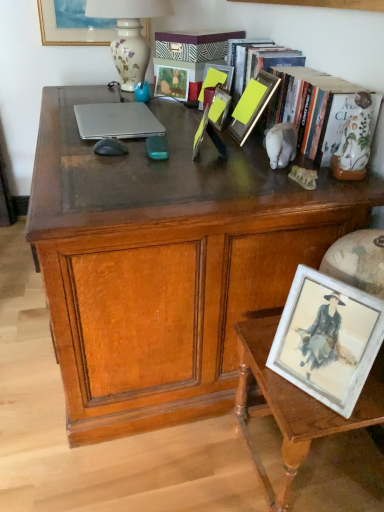
Question: Is wooden table at lower right bigger than matte gold picture frame at upper left, which is the seventh picture frame from front to back?

Choices:
 (A) no
 (B) yes

Answer: (B)

Question: Is matte gold picture frame at upper left, which is the seventh picture frame from front to back, a part of wooden table at lower right?

Choices:
 (A) yes
 (B) no

Answer: (B)

Question: From the image's perspective, is wooden table at lower right located beneath matte gold picture frame at upper left, which is the seventh picture frame from front to back?

Choices:
 (A) no
 (B) yes

Answer: (B)

Question: Is wooden table at lower right with matte gold picture frame at upper left, which is the seventh picture frame from front to back?

Choices:
 (A) yes
 (B) no

Answer: (B)

Question: From the image's perspective, is wooden table at lower right on top of matte gold picture frame at upper left, which appears as the 1th picture frame when viewed from the top?

Choices:
 (A) no
 (B) yes

Answer: (A)

Question: In terms of height, does wooden table at lower right look taller or shorter compared to matte glass picture frame at center, the 4th picture frame in the bottom-to-top sequence?

Choices:
 (A) tall
 (B) short

Answer: (A)

Question: From the image's perspective, is wooden table at lower right positioned above or below matte glass picture frame at center, the 4th picture frame in the bottom-to-top sequence?

Choices:
 (A) below
 (B) above

Answer: (A)

Question: From a real-world perspective, is wooden table at lower right above or below matte glass picture frame at center, which is the fourth picture frame from front to back?

Choices:
 (A) below
 (B) above

Answer: (A)

Question: Is wooden table at lower right in front of or behind matte glass picture frame at center, the 4th picture frame in the bottom-to-top sequence, in the image?

Choices:
 (A) behind
 (B) front

Answer: (B)

Question: In terms of width, does yellow matte picture frame at center, the second picture frame in the front-to-back sequence, look wider or thinner when compared to matte gold picture frame at upper left, arranged as the 7th picture frame when ordered from the bottom?

Choices:
 (A) wide
 (B) thin

Answer: (A)

Question: Which is correct: yellow matte picture frame at center, placed as the 2th picture frame when sorted from bottom to top, is inside matte gold picture frame at upper left, arranged as the 7th picture frame when ordered from the bottom, or outside of it?

Choices:
 (A) outside
 (B) inside

Answer: (A)

Question: In terms of height, does yellow matte picture frame at center, placed as the 2th picture frame when sorted from bottom to top, look taller or shorter compared to matte gold picture frame at upper left, which is the seventh picture frame from front to back?

Choices:
 (A) tall
 (B) short

Answer: (A)

Question: Relative to matte gold picture frame at upper left, which is the seventh picture frame from front to back, is yellow matte picture frame at center, which ranks as the 6th picture frame in top-to-bottom order, in front or behind?

Choices:
 (A) front
 (B) behind

Answer: (A)

Question: Visually, is hardcover book at upper right positioned to the left or to the right of matte wooden picture frame at center, arranged as the 3th picture frame when viewed from the top?

Choices:
 (A) left
 (B) right

Answer: (B)

Question: Does point (266, 39) appear closer or farther from the camera than point (165, 95)?

Choices:
 (A) farther
 (B) closer

Answer: (B)